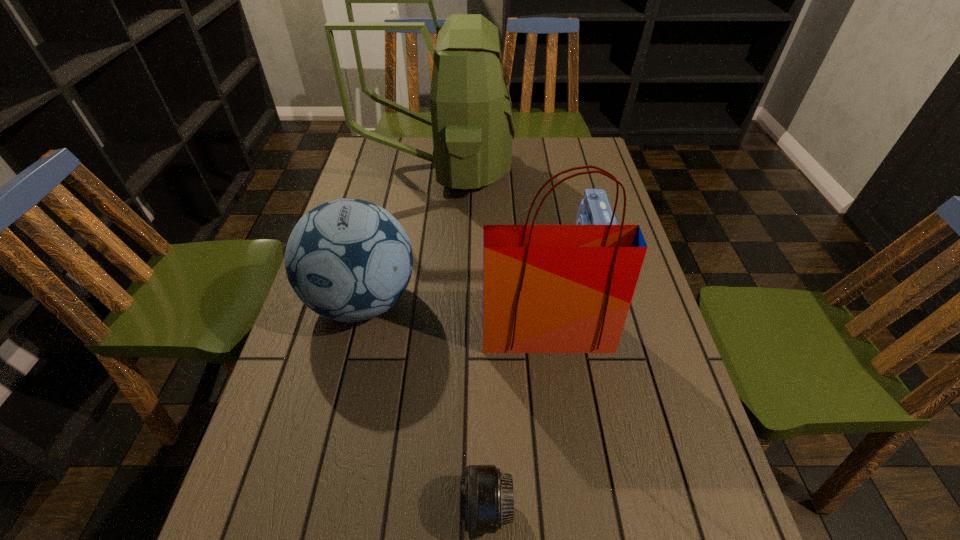
At what (x,y) coordinates should I click in order to perform the action: click on the farthest object. Please return your answer as a coordinate pair (x, y). The height and width of the screenshot is (540, 960). Looking at the image, I should click on (472, 120).

Image resolution: width=960 pixels, height=540 pixels. What are the coordinates of `shopping bag` in the screenshot? It's located at (546, 288).

Identify the location of soccer ball. The image size is (960, 540). (348, 260).

Image resolution: width=960 pixels, height=540 pixels. Find the location of `camera`. camera is located at coordinates [594, 209].

The width and height of the screenshot is (960, 540). In order to click on vacant space located 0.200m on the front pocket of the farthest object in this screenshot , I will do `click(567, 171)`.

The height and width of the screenshot is (540, 960). I want to click on vacant space located 0.360m on the handle side of the shopping bag, so click(x=572, y=528).

This screenshot has width=960, height=540. I want to click on free location located 0.100m on the side with brand of the third tallest object, so click(x=342, y=386).

You are a GUI agent. You are given a task and a screenshot of the screen. Output one action in this format:
    pyautogui.click(x=<x>, y=<y>)
    Task: Click on the free space located 0.310m on the lens of the fourth tallest object
    The width and height of the screenshot is (960, 540).
    Given the screenshot: What is the action you would take?
    pyautogui.click(x=470, y=243)

The width and height of the screenshot is (960, 540). I want to click on vacant space located 0.360m on the lens of the fourth tallest object, so click(453, 243).

Find the location of a particular element. The width and height of the screenshot is (960, 540). vacant area situated 0.280m on the lens of the fourth tallest object is located at coordinates (480, 243).